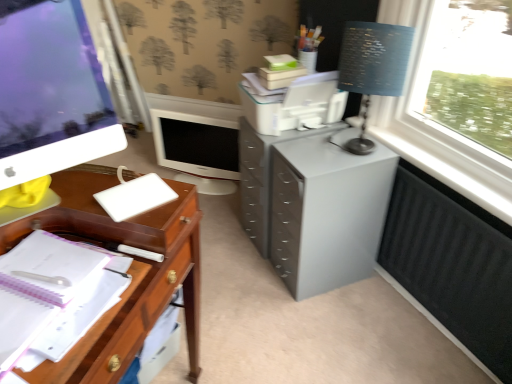
Describe the element at coordinates (135, 197) in the screenshot. This screenshot has height=384, width=512. I see `white matte notebook at left` at that location.

The image size is (512, 384). Identify the location of white matte notebook at left. (135, 197).

This screenshot has height=384, width=512. What do you see at coordinates (313, 207) in the screenshot?
I see `gray matte filing cabinet at center-right` at bounding box center [313, 207].

The width and height of the screenshot is (512, 384). I want to click on white glossy computer monitor at left, acting as the second computer monitor starting from the back, so click(x=51, y=95).

Locate an element on the screen. white matte notebook at left is located at coordinates (135, 197).

Which object is positioned more to the right, black matte radiator at lower right or gray matte filing cabinet at center-right?

black matte radiator at lower right.

Can we say black matte radiator at lower right lies outside gray matte filing cabinet at center-right?

Absolutely, black matte radiator at lower right is external to gray matte filing cabinet at center-right.

Are black matte radiator at lower right and gray matte filing cabinet at center-right far apart?

Actually, black matte radiator at lower right and gray matte filing cabinet at center-right are a little close together.

Is black matte radiator at lower right closer to camera compared to gray matte filing cabinet at center-right?

No, the depth of black matte radiator at lower right is greater than that of gray matte filing cabinet at center-right.

Is white plastic pen at left surrounding black matte radiator at lower right?

Definitely not — black matte radiator at lower right is not inside white plastic pen at left.

The image size is (512, 384). Identify the location of office supplies in front of the black matte radiator at lower right. (66, 285).

Which is behind, white plastic pen at left or black matte radiator at lower right?

Positioned behind is black matte radiator at lower right.

Is gray matte filing cabinet at center-right positioned with its back to white glossy computer monitor at left, placed as the 1th computer monitor when sorted from front to back?

No, gray matte filing cabinet at center-right's orientation is not away from white glossy computer monitor at left, placed as the 1th computer monitor when sorted from front to back.

Which is correct: gray matte filing cabinet at center-right is inside white glossy computer monitor at left, placed as the 1th computer monitor when sorted from front to back, or outside of it?

gray matte filing cabinet at center-right cannot be found inside white glossy computer monitor at left, placed as the 1th computer monitor when sorted from front to back.

From a real-world perspective, is gray matte filing cabinet at center-right positioned over white glossy computer monitor at left, placed as the 1th computer monitor when sorted from front to back, based on gravity?

No.

Considering the points (344, 223) and (5, 170), which point is behind, point (344, 223) or point (5, 170)?

Positioned behind is point (344, 223).

Is white glossy computer monitor at center, the second computer monitor positioned from the front, touching white glossy computer monitor at left, placed as the 1th computer monitor when sorted from front to back?

No, white glossy computer monitor at center, the second computer monitor positioned from the front, is not in contact with white glossy computer monitor at left, placed as the 1th computer monitor when sorted from front to back.

Is white glossy computer monitor at left, placed as the 1th computer monitor when sorted from front to back, located within white glossy computer monitor at center, the second computer monitor positioned from the front?

No, white glossy computer monitor at center, the second computer monitor positioned from the front, does not contain white glossy computer monitor at left, placed as the 1th computer monitor when sorted from front to back.

Which of these two, white glossy computer monitor at center, which is the 1th computer monitor in back-to-front order, or white glossy computer monitor at left, acting as the second computer monitor starting from the back, is thinner?

With smaller width is white glossy computer monitor at center, which is the 1th computer monitor in back-to-front order.

Is blue fabric lampshade at upper right in front of or behind white glossy computer monitor at center, the second computer monitor positioned from the front, in the image?

blue fabric lampshade at upper right is in front of white glossy computer monitor at center, the second computer monitor positioned from the front.

Can you confirm if blue fabric lampshade at upper right is smaller than white glossy computer monitor at center, the second computer monitor positioned from the front?

Correct, blue fabric lampshade at upper right occupies less space than white glossy computer monitor at center, the second computer monitor positioned from the front.

In the scene shown: Is blue fabric lampshade at upper right oriented away from white glossy computer monitor at center, the second computer monitor positioned from the front?

No, blue fabric lampshade at upper right's orientation is not away from white glossy computer monitor at center, the second computer monitor positioned from the front.

Between blue fabric lampshade at upper right and white glossy computer monitor at center, the second computer monitor positioned from the front, which one has more height?

With more height is blue fabric lampshade at upper right.

From a real-world perspective, which is physically above, blue fabric lampshade at upper right or white glossy computer monitor at left, placed as the 1th computer monitor when sorted from front to back?

white glossy computer monitor at left, placed as the 1th computer monitor when sorted from front to back.

From the image's perspective, which is below, blue fabric lampshade at upper right or white glossy computer monitor at left, placed as the 1th computer monitor when sorted from front to back?

white glossy computer monitor at left, placed as the 1th computer monitor when sorted from front to back, appears lower in the image.

Considering the relative positions of blue fabric lampshade at upper right and white glossy computer monitor at left, placed as the 1th computer monitor when sorted from front to back, in the image provided, is blue fabric lampshade at upper right to the left of white glossy computer monitor at left, placed as the 1th computer monitor when sorted from front to back, from the viewer's perspective?

No, blue fabric lampshade at upper right is not to the left of white glossy computer monitor at left, placed as the 1th computer monitor when sorted from front to back.

Is the surface of blue fabric lampshade at upper right in direct contact with white glossy computer monitor at left, placed as the 1th computer monitor when sorted from front to back?

blue fabric lampshade at upper right is not next to white glossy computer monitor at left, placed as the 1th computer monitor when sorted from front to back, and they're not touching.

Between white glossy computer monitor at left, placed as the 1th computer monitor when sorted from front to back, and white matte notebook at left, which one is positioned in front?

white glossy computer monitor at left, placed as the 1th computer monitor when sorted from front to back, is in front.

From the picture: Is white glossy computer monitor at left, placed as the 1th computer monitor when sorted from front to back, spatially inside white matte notebook at left, or outside of it?

white glossy computer monitor at left, placed as the 1th computer monitor when sorted from front to back, lies outside white matte notebook at left.

How far apart are white glossy computer monitor at left, acting as the second computer monitor starting from the back, and white matte notebook at left?

A distance of 8.97 inches exists between white glossy computer monitor at left, acting as the second computer monitor starting from the back, and white matte notebook at left.

The width and height of the screenshot is (512, 384). I want to click on notebook below the white glossy computer monitor at left, placed as the 1th computer monitor when sorted from front to back (from a real-world perspective), so click(x=135, y=197).

Image resolution: width=512 pixels, height=384 pixels. Identify the location of filing cabinet located above the black matte radiator at lower right (from a real-world perspective). (313, 207).

The width and height of the screenshot is (512, 384). What are the coordinates of `radiator that is on the right side of white plastic pen at left` in the screenshot? It's located at (452, 263).

Which object lies further to the anchor point white glossy computer monitor at left, acting as the second computer monitor starting from the back, white matte notebook at left or white glossy computer monitor at center, the second computer monitor positioned from the front?

white glossy computer monitor at center, the second computer monitor positioned from the front, is positioned further to the anchor white glossy computer monitor at left, acting as the second computer monitor starting from the back.

Considering their positions, is white glossy computer monitor at left, placed as the 1th computer monitor when sorted from front to back, positioned further to blue fabric lampshade at upper right than gray matte filing cabinet at center-right?

The object further to blue fabric lampshade at upper right is white glossy computer monitor at left, placed as the 1th computer monitor when sorted from front to back.

Based on their spatial positions, is white matte notebook at left or white plastic pen at left closer to white glossy computer monitor at left, acting as the second computer monitor starting from the back?

white matte notebook at left lies closer to white glossy computer monitor at left, acting as the second computer monitor starting from the back, than the other object.

Looking at this image, estimate the real-world distances between objects in this image. Which object is further from white matte notebook at left, gray matte filing cabinet at center-right or white glossy computer monitor at left, placed as the 1th computer monitor when sorted from front to back?

Among the two, gray matte filing cabinet at center-right is located further to white matte notebook at left.

When comparing their distances from white matte notebook at left, does gray matte filing cabinet at center-right or black matte radiator at lower right seem closer?

gray matte filing cabinet at center-right.

Which object lies nearer to the anchor point white matte notebook at left, black matte radiator at lower right or gray matte filing cabinet at center-right?

Based on the image, gray matte filing cabinet at center-right appears to be nearer to white matte notebook at left.

Based on their spatial positions, is black matte radiator at lower right or white matte notebook at left further from white glossy computer monitor at center, the second computer monitor positioned from the front?

white matte notebook at left.

From the image, which object appears to be farther from white matte notebook at left, white plastic pen at left or white glossy computer monitor at center, the second computer monitor positioned from the front?

white glossy computer monitor at center, the second computer monitor positioned from the front, lies further to white matte notebook at left than the other object.

Find the location of a particular element. notebook between white plastic pen at left and black matte radiator at lower right is located at coordinates point(135,197).

You are a GUI agent. You are given a task and a screenshot of the screen. Output one action in this format:
    pyautogui.click(x=<x>, y=<y>)
    Task: Click on the filing cabinet between white plastic pen at left and white glossy computer monitor at center, the second computer monitor positioned from the front, from front to back
    This screenshot has height=384, width=512.
    Given the screenshot: What is the action you would take?
    pyautogui.click(x=313, y=207)

At what (x,y) coordinates should I click in order to perform the action: click on table lamp between white plastic pen at left and black matte radiator at lower right. Please return your answer as a coordinate pair (x, y). Looking at the image, I should click on (372, 67).

The height and width of the screenshot is (384, 512). What are the coordinates of `notebook between white glossy computer monitor at left, placed as the 1th computer monitor when sorted from front to back, and blue fabric lampshade at upper right` in the screenshot? It's located at (135, 197).